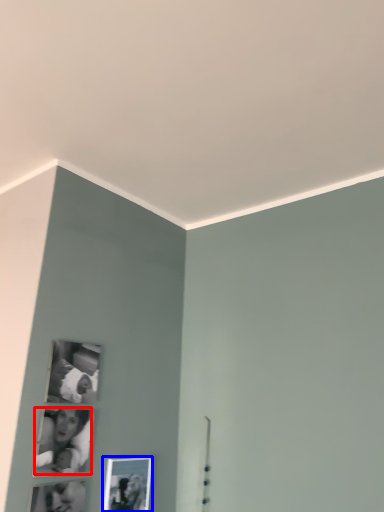
Question: Which point is further to the camera, couple (highlighted by a red box) or picture frame (highlighted by a blue box)?

Choices:
 (A) couple
 (B) picture frame

Answer: (B)